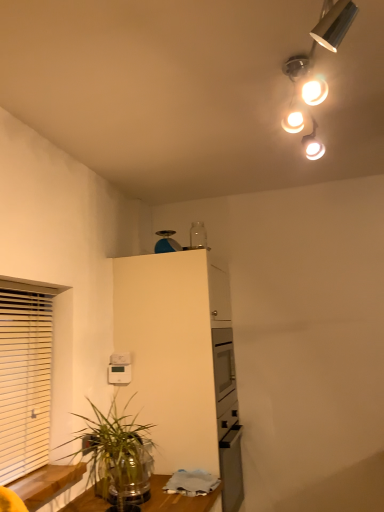
Question: Does green leafy plant at lower left have a larger size compared to blue plastic scale at upper center?

Choices:
 (A) yes
 (B) no

Answer: (A)

Question: Is green leafy plant at lower left smaller than blue plastic scale at upper center?

Choices:
 (A) yes
 (B) no

Answer: (B)

Question: Does green leafy plant at lower left come in front of blue plastic scale at upper center?

Choices:
 (A) yes
 (B) no

Answer: (A)

Question: Is green leafy plant at lower left oriented away from blue plastic scale at upper center?

Choices:
 (A) yes
 (B) no

Answer: (B)

Question: Is green leafy plant at lower left in contact with blue plastic scale at upper center?

Choices:
 (A) no
 (B) yes

Answer: (A)

Question: In terms of width, does blue plastic scale at upper center look wider or thinner when compared to matte silver lamp at upper right?

Choices:
 (A) thin
 (B) wide

Answer: (A)

Question: Is blue plastic scale at upper center taller or shorter than matte silver lamp at upper right?

Choices:
 (A) tall
 (B) short

Answer: (B)

Question: From the image's perspective, is blue plastic scale at upper center positioned above or below matte silver lamp at upper right?

Choices:
 (A) below
 (B) above

Answer: (A)

Question: Looking at the image, does blue plastic scale at upper center seem bigger or smaller compared to matte silver lamp at upper right?

Choices:
 (A) small
 (B) big

Answer: (A)

Question: Considering the relative positions of white matte cabinet at upper center and white wooden blinds at left in the image provided, is white matte cabinet at upper center to the left or to the right of white wooden blinds at left?

Choices:
 (A) left
 (B) right

Answer: (B)

Question: Based on their sizes in the image, would you say white matte cabinet at upper center is bigger or smaller than white wooden blinds at left?

Choices:
 (A) small
 (B) big

Answer: (B)

Question: Is point (160, 302) positioned closer to the camera than point (24, 428)?

Choices:
 (A) closer
 (B) farther

Answer: (B)

Question: Considering the positions of white matte cabinet at upper center and white wooden blinds at left in the image, is white matte cabinet at upper center wider or thinner than white wooden blinds at left?

Choices:
 (A) wide
 (B) thin

Answer: (A)

Question: In the image, is blue plastic scale at upper center positioned in front of or behind green leafy plant at lower left?

Choices:
 (A) behind
 (B) front

Answer: (A)

Question: Is point (162, 236) positioned closer to the camera than point (114, 470)?

Choices:
 (A) farther
 (B) closer

Answer: (A)